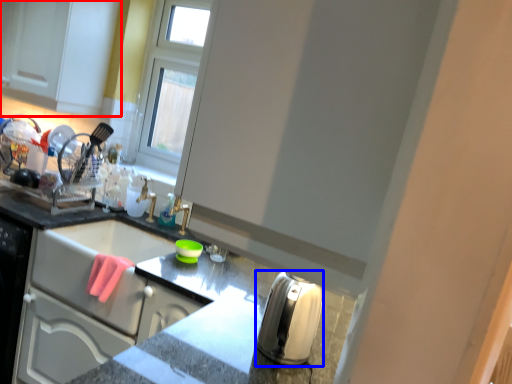
Question: Which object is closer to the camera taking this photo, cabinetry (highlighted by a red box) or appliance (highlighted by a blue box)?

Choices:
 (A) cabinetry
 (B) appliance

Answer: (B)